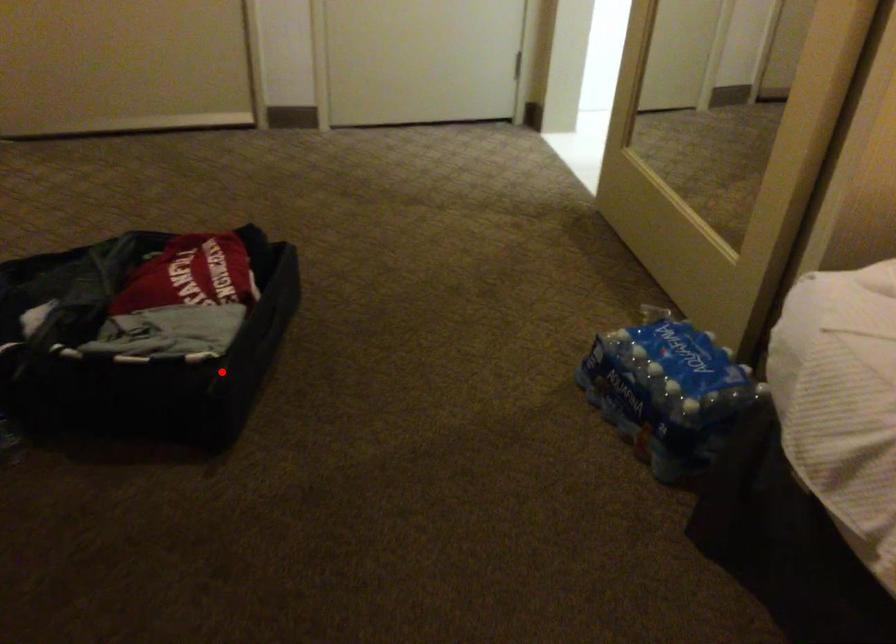
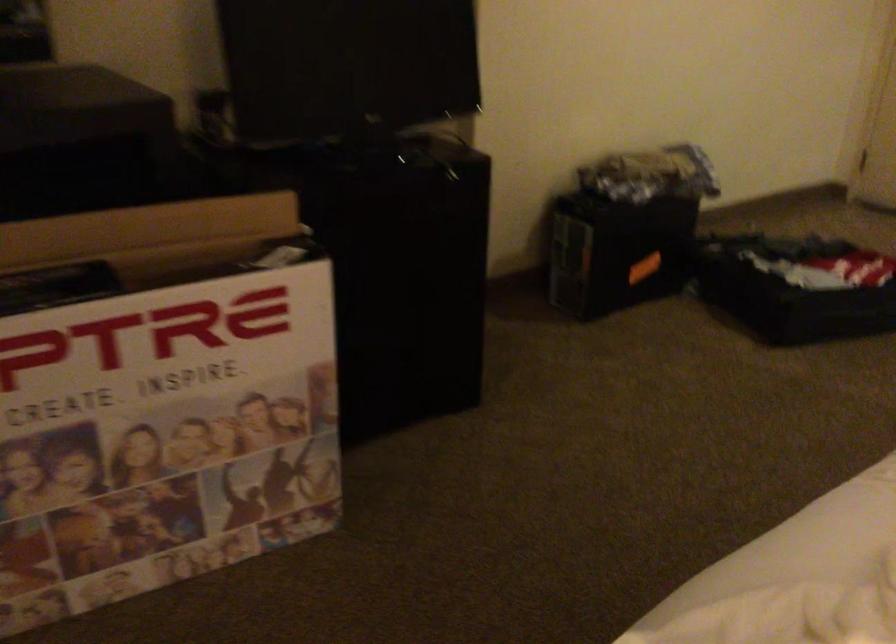
Question: A red point is marked in image1. In image2, is the corresponding 3D point closer to the camera or farther? Reply with the corresponding letter.

Choices:
 (A) The corresponding 3D point is closer.
 (B) The corresponding 3D point is farther.

Answer: (B)